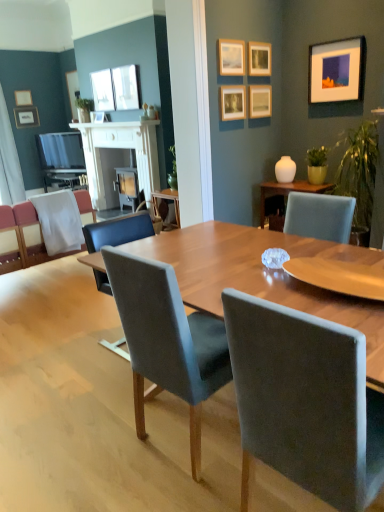
Identify the location of vacant area on top of matte gray table at center (from a real-world perspective). This screenshot has height=512, width=384. (100, 410).